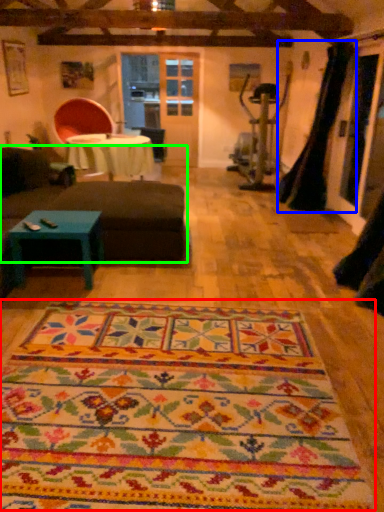
Question: Considering the real-world distances, which object is closest to mat (highlighted by a red box)? curtain (highlighted by a blue box) or studio couch (highlighted by a green box).

Choices:
 (A) curtain
 (B) studio couch

Answer: (B)